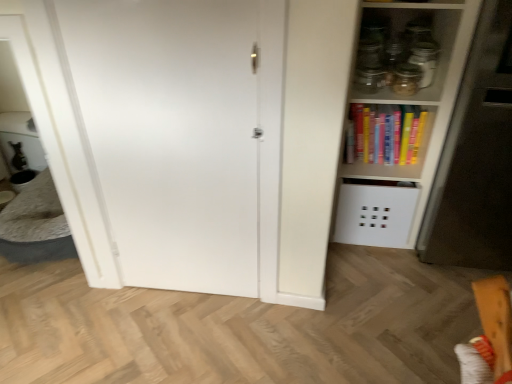
Identify the location of vacant space that is to the left of white matte door at center. This screenshot has width=512, height=384. (113, 314).